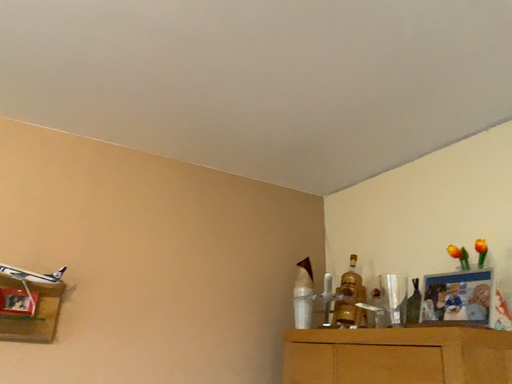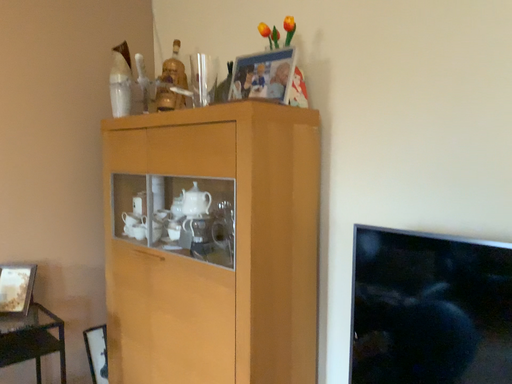
Question: Which way did the camera rotate in the video?

Choices:
 (A) rotated left
 (B) rotated right

Answer: (B)